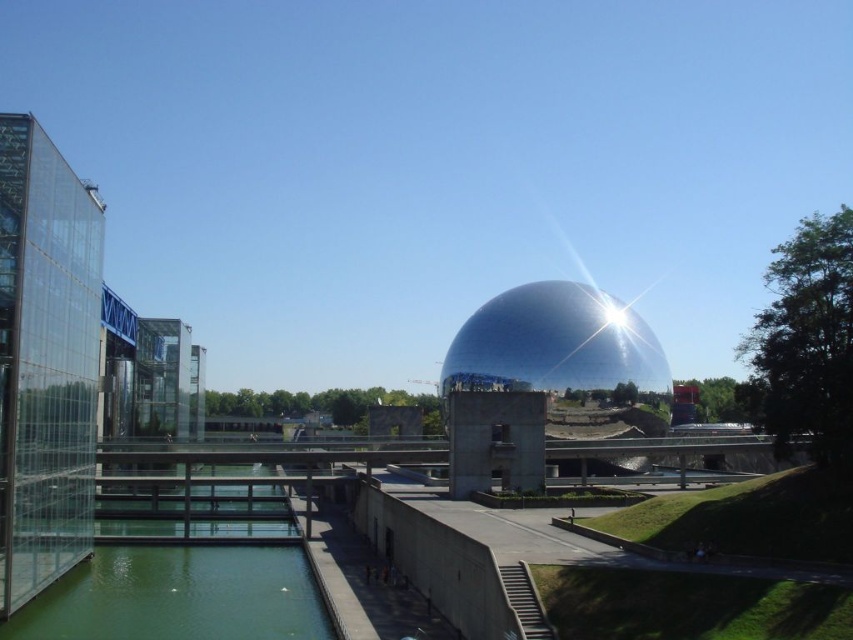
You are a visitor at the modern architectural complex. You see the green glass water at lower left and the glossy metallic dome at center. Which object is positioned lower in the scene?

The green glass water at lower left is located below the glossy metallic dome at center, so it is positioned lower in the scene.

You are an architect designing a new pathway that needs to pass between the green glass water at lower left and the glossy metallic dome at center. Which object requires more consideration in terms of space allocation for the pathway?

The glossy metallic dome at center requires more consideration in terms of space allocation for the pathway because it occupies more space than the green glass water at lower left.